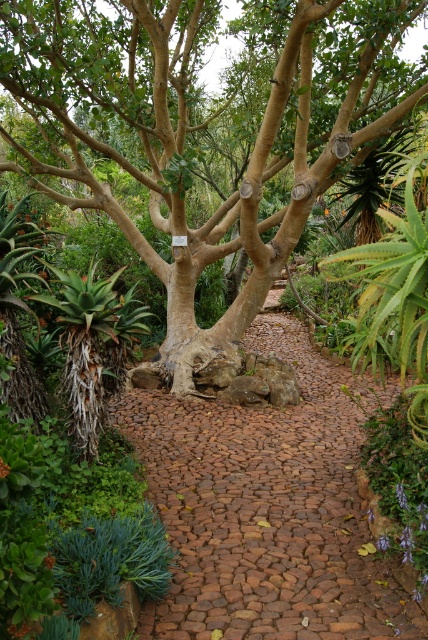
Between point (371, 49) and point (306, 384), which one is positioned behind?

The point (306, 384) is more distant.

The image size is (428, 640). Identify the location of brown textured tree at center. coord(201,128).